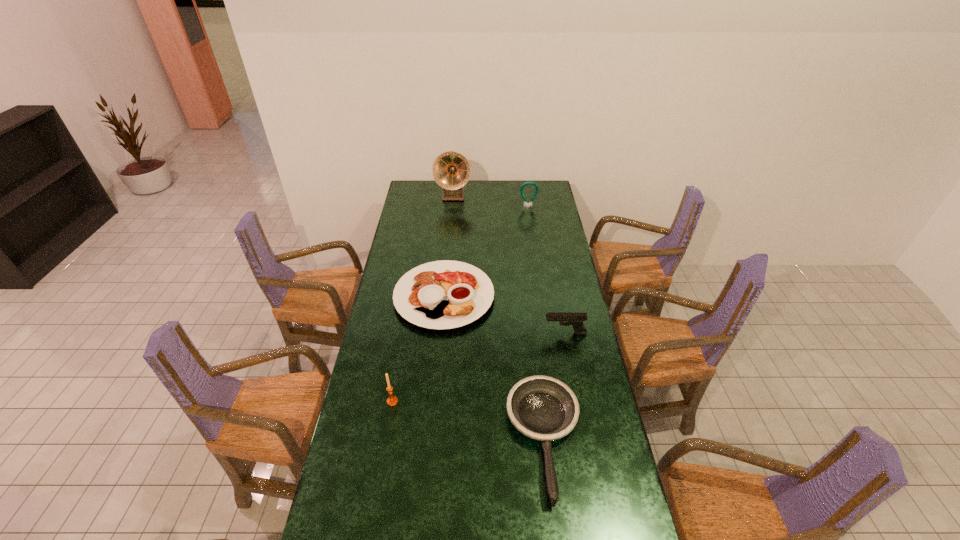
At what (x,y) coordinates should I click in order to perform the action: click on phonograph record. Please return your answer as a coordinate pair (x, y). This screenshot has width=960, height=540. Looking at the image, I should click on (451, 170).

The height and width of the screenshot is (540, 960). In order to click on the farthest object in this screenshot , I will do `click(451, 170)`.

The width and height of the screenshot is (960, 540). In order to click on bottle opener in this screenshot , I will do `click(529, 182)`.

Find the location of a particular element. The height and width of the screenshot is (540, 960). candle_holder is located at coordinates (392, 400).

The height and width of the screenshot is (540, 960). In order to click on pistol in this screenshot , I will do `click(576, 320)`.

Locate an element on the screen. The width and height of the screenshot is (960, 540). frying pan is located at coordinates (543, 408).

Where is `platter`? The width and height of the screenshot is (960, 540). platter is located at coordinates (445, 294).

The image size is (960, 540). Find the location of `free point located 0.080m on the horn of the farthest object`. free point located 0.080m on the horn of the farthest object is located at coordinates (452, 211).

You are a GUI agent. You are given a task and a screenshot of the screen. Output one action in this format:
    pyautogui.click(x=<x>, y=<y>)
    Task: Click on the free location located at the jaws of the fifth nearest object
    
    Given the screenshot: What is the action you would take?
    pyautogui.click(x=530, y=216)

Where is `vacant space situated 0.180m on the front of the candle_holder`? vacant space situated 0.180m on the front of the candle_holder is located at coordinates (383, 456).